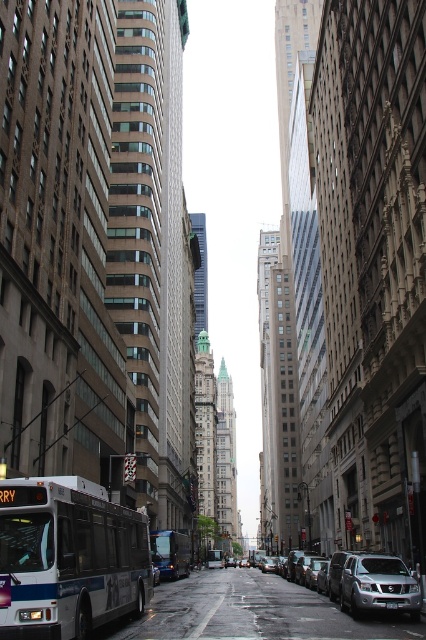
You are a pedestrian standing at the crosswalk near the silver metallic suv at lower right and the blue metallic bus at center. Which vehicle is closer to you?

The silver metallic suv at lower right is closer to you because it is positioned in front of the blue metallic bus at center.

You are driving a delivery van that is 6 meters long and need to park it between the silver metallic suv at lower right and the blue metallic bus at center. Is there enough space between them to park your van?

The distance between the silver metallic suv at lower right and the blue metallic bus at center is 25.23 meters. Since your van is only 6 meters long, there is more than enough space to park it between them.

You are standing at the intersection and want to cross the street to reach the point marked by the coordinates point (x=370, y=582). Given that the crosswalk is directly in front of you, which direction should you walk to reach the point?

The point (x=370, y=582) is located at the lower right of the image, so you should walk towards the lower right direction to reach it.